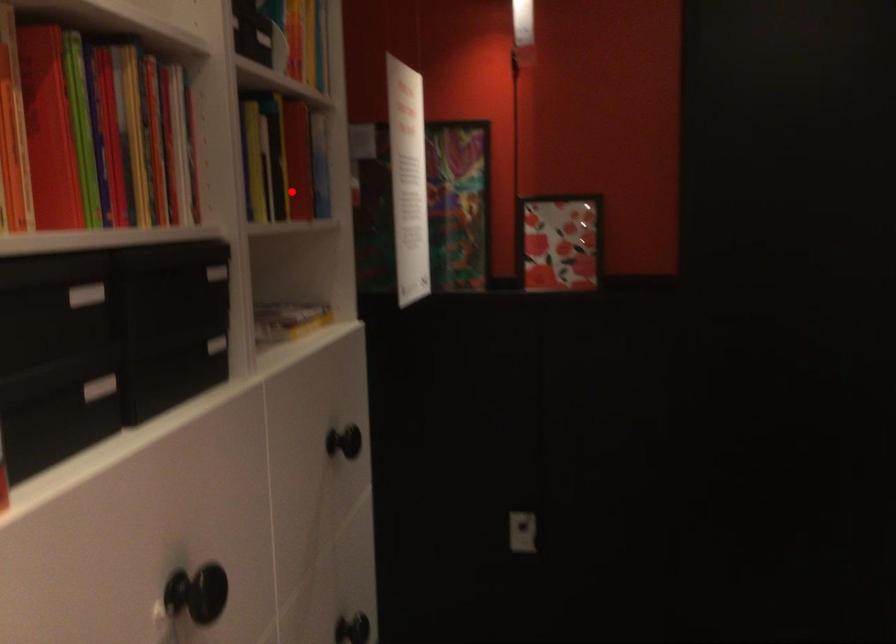
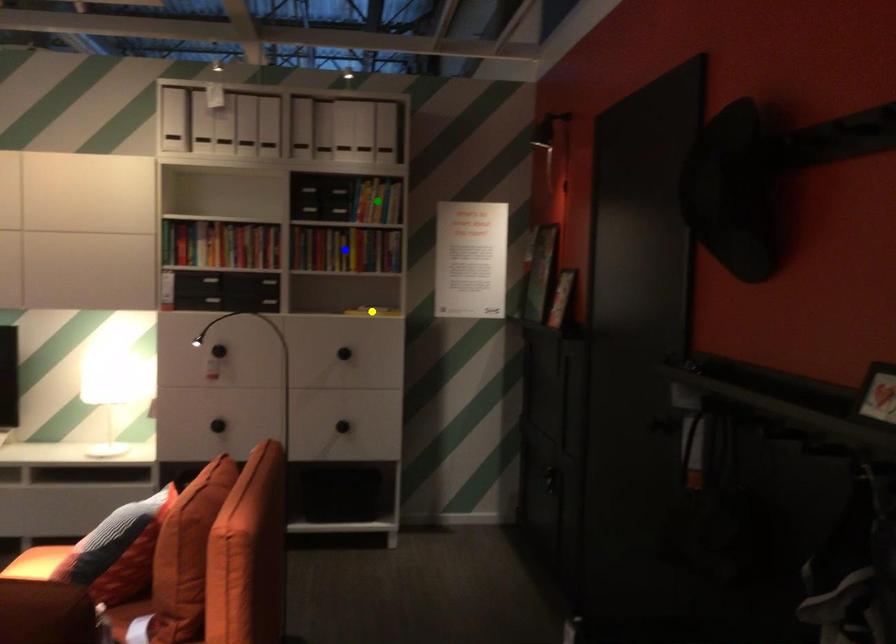
Question: I am providing you with two images of the same scene from different viewpoints. A red point is marked on the first image. You are given multiple points on the second image. Which mark in image 2 goes with the point in image 1?

Choices:
 (A) green point
 (B) blue point
 (C) yellow point

Answer: (B)